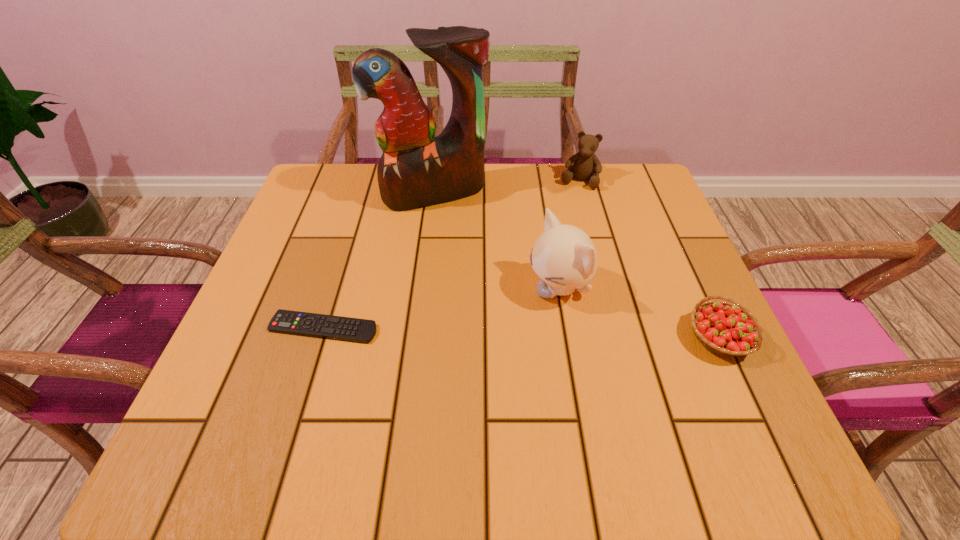
Locate an element on the screen. Image resolution: width=960 pixels, height=540 pixels. blank area in the image that satisfies the following two spatial constraints: 1. on the back side of the tallest object; 2. on the left side of the third shortest object is located at coordinates (436, 180).

Where is `free space that satisfies the following two spatial constraints: 1. on the back side of the kitten; 2. on the left side of the third shortest object`? Image resolution: width=960 pixels, height=540 pixels. free space that satisfies the following two spatial constraints: 1. on the back side of the kitten; 2. on the left side of the third shortest object is located at coordinates pyautogui.click(x=540, y=180).

Identify the location of free region that satisfies the following two spatial constraints: 1. on the front side of the remote control; 2. on the left side of the rightmost object. This screenshot has height=540, width=960. (321, 338).

This screenshot has height=540, width=960. I want to click on vacant space that satisfies the following two spatial constraints: 1. on the back side of the shortest object; 2. on the left side of the parrot, so click(365, 193).

The image size is (960, 540). What are the coordinates of `vacant area in the image that satisfies the following two spatial constraints: 1. on the front side of the strawberry; 2. on the left side of the kitten` in the screenshot? It's located at (566, 338).